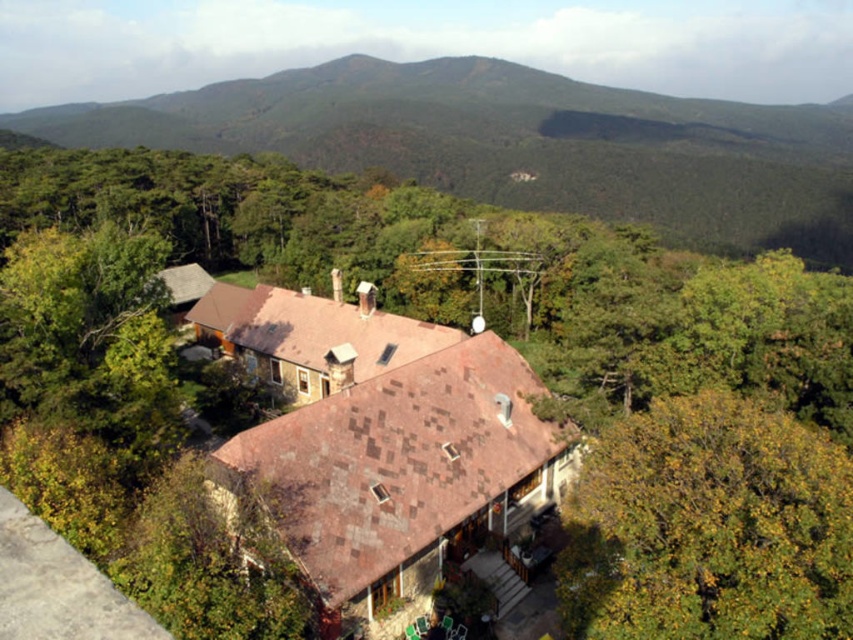
You are standing in front of the house in the image. Looking at the scene, where is the green forested mountain at upper center located in terms of its 2D coordinates?

The green forested mountain at upper center is located at the 2D coordinates of point (519, 144).

You are standing at the base of the house in the image. Looking towards the upper center, what geographical feature do you see at the point marked by coordinates (519, 144)?

The point at coordinates (519, 144) corresponds to a green forested mountain at upper center.